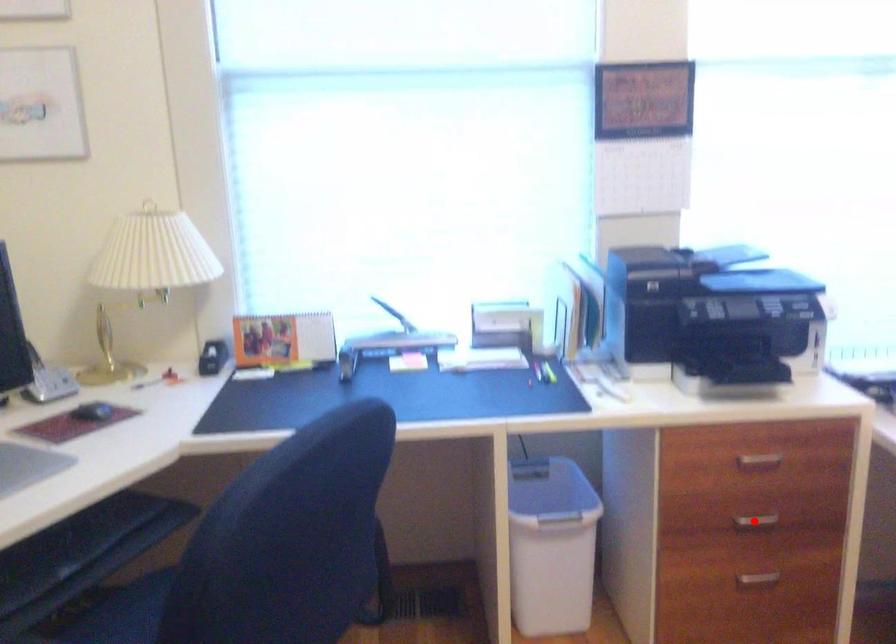
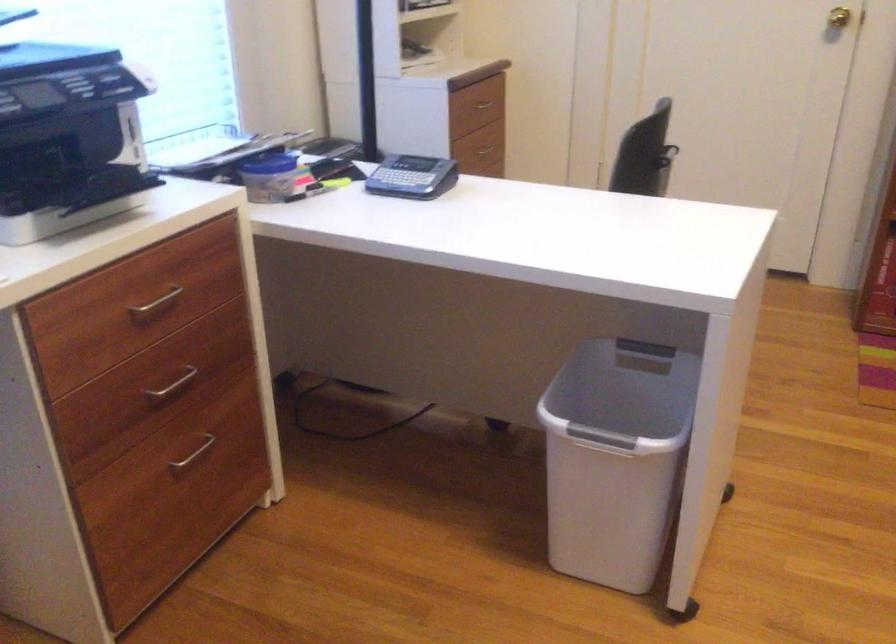
Question: I am providing you with two images of the same scene from different viewpoints. A red point is shown in image1. For the corresponding object point in image2, is it positioned nearer or farther from the camera?

Choices:
 (A) Nearer
 (B) Farther

Answer: (A)